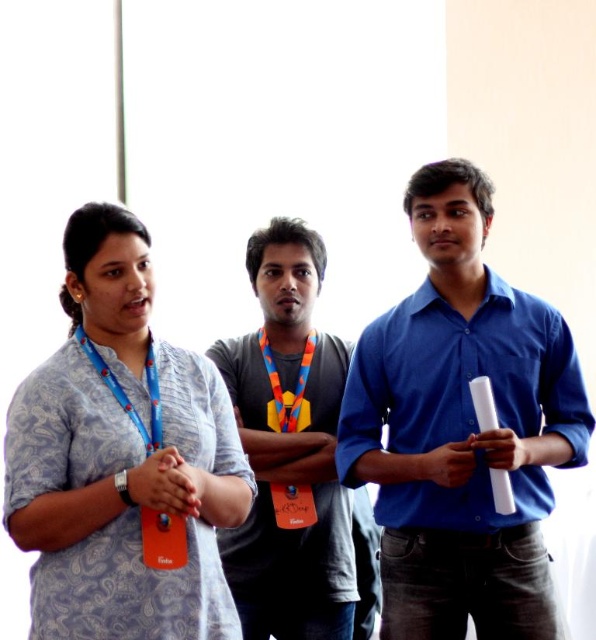
Question: Which point appears farthest from the camera in this image?

Choices:
 (A) (257, 243)
 (B) (156, 426)
 (C) (57, 524)
 (D) (134, 333)

Answer: (A)

Question: Is blue cotton shirt at center wider than blue printed kurta at center?

Choices:
 (A) yes
 (B) no

Answer: (A)

Question: Observing the image, what is the correct spatial positioning of blue fabric lanyard at left in reference to orange fabric at center?

Choices:
 (A) below
 (B) above

Answer: (A)

Question: Can you confirm if blue printed kurta at center is bigger than dark gray cotton t-shirt at center?

Choices:
 (A) no
 (B) yes

Answer: (A)

Question: Among these objects, which one is nearest to the camera?

Choices:
 (A) blue printed kurta at center
 (B) orange fabric at center
 (C) blue cotton shirt at center

Answer: (A)

Question: Which object appears closest to the camera in this image?

Choices:
 (A) orange fabric at center
 (B) blue cotton shirt at center
 (C) dark gray cotton t-shirt at center
 (D) multicolored fabric lanyard at center

Answer: (B)